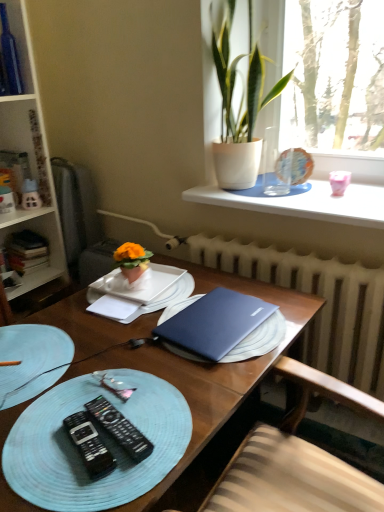
Image resolution: width=384 pixels, height=512 pixels. I want to click on vacant space in between black plastic remote control at lower left, which ranks as the second remote control in left-to-right order, and white matte notebook at center, so click(120, 362).